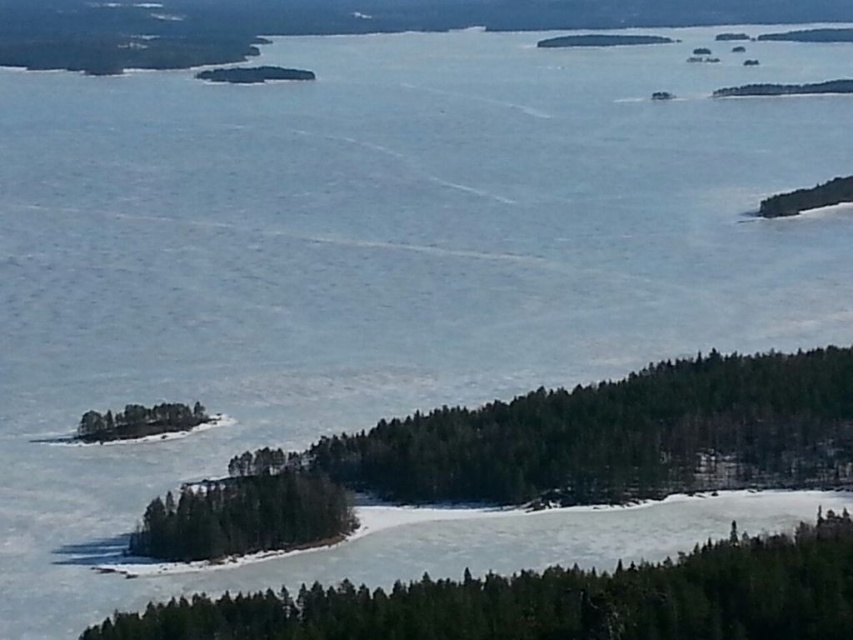
Question: Does green matte trees at center appear on the left side of green matte tree at lower center?

Choices:
 (A) yes
 (B) no

Answer: (A)

Question: Where is green matte trees at center located in relation to green matte tree at center in the image?

Choices:
 (A) right
 (B) left

Answer: (A)

Question: Which point is farther to the camera?

Choices:
 (A) (178, 406)
 (B) (465, 596)
 (C) (260, 532)

Answer: (A)

Question: Is green matte trees at center to the right of green matte tree at lower center from the viewer's perspective?

Choices:
 (A) yes
 (B) no

Answer: (B)

Question: Which point is farther from the camera taking this photo?

Choices:
 (A) (407, 628)
 (B) (103, 440)

Answer: (B)

Question: Which of these objects is positioned farthest from the green matte tree at center?

Choices:
 (A) green matte tree at lower center
 (B) green matte island at lower left

Answer: (A)